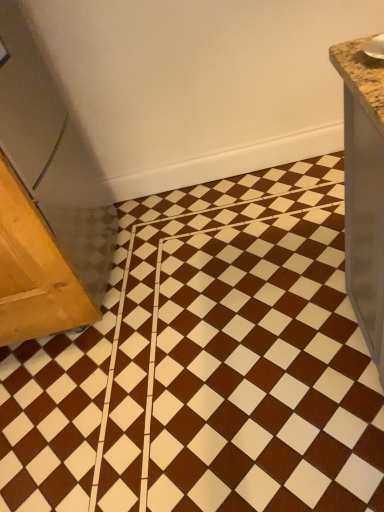
Question: Is wooden table at left spatially inside brown glossy ceramic tile at center, or outside of it?

Choices:
 (A) inside
 (B) outside

Answer: (B)

Question: Considering the relative positions of wooden table at left and brown glossy ceramic tile at center in the image provided, is wooden table at left to the left or to the right of brown glossy ceramic tile at center?

Choices:
 (A) right
 (B) left

Answer: (B)

Question: Does point (61, 280) appear closer or farther from the camera than point (342, 289)?

Choices:
 (A) farther
 (B) closer

Answer: (B)

Question: Does point (360, 392) appear closer or farther from the camera than point (19, 307)?

Choices:
 (A) closer
 (B) farther

Answer: (A)

Question: From a real-world perspective, relative to wooden table at left, is brown glossy ceramic tile at center vertically above or below?

Choices:
 (A) above
 (B) below

Answer: (B)

Question: Is brown glossy ceramic tile at center to the left or to the right of wooden table at left in the image?

Choices:
 (A) left
 (B) right

Answer: (B)

Question: Is brown glossy ceramic tile at center situated inside wooden table at left or outside?

Choices:
 (A) inside
 (B) outside

Answer: (B)